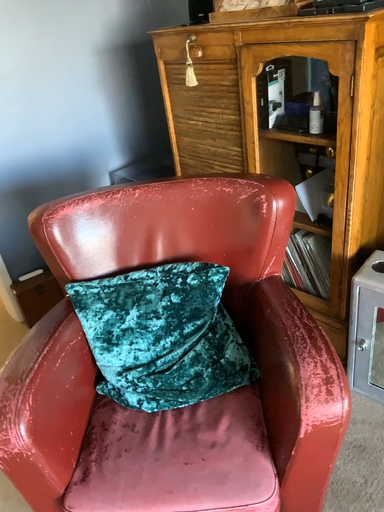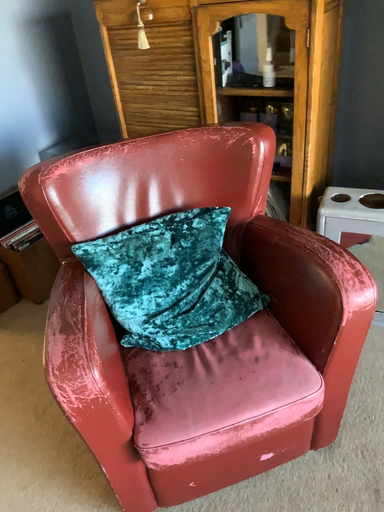
Question: Which way did the camera rotate in the video?

Choices:
 (A) rotated left
 (B) rotated right

Answer: (B)